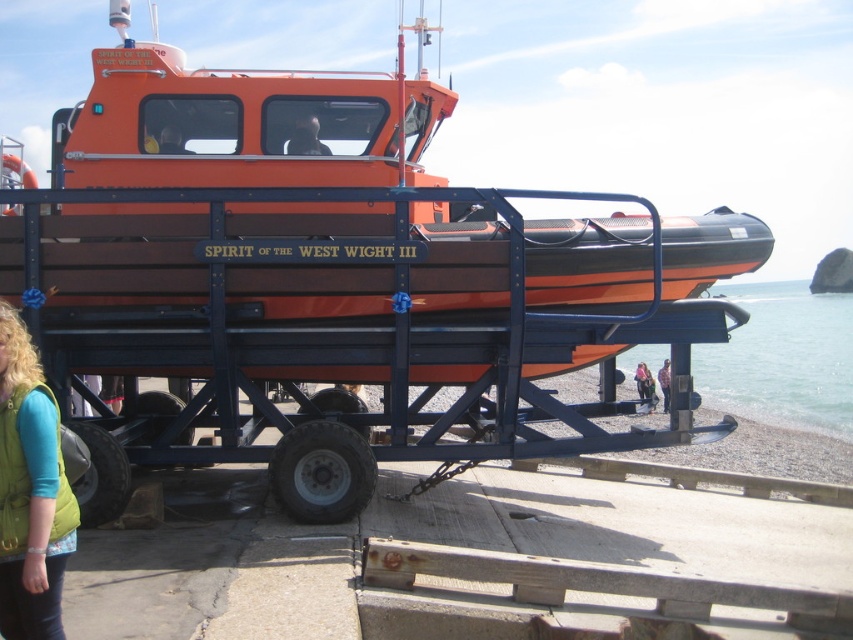
Which is behind, point (15, 483) or point (639, 364)?

Positioned behind is point (639, 364).

Which is more to the left, green fabric vest at lower left or light brown leather jacket at lower center?

green fabric vest at lower left is more to the left.

What do you see at coordinates (30, 492) in the screenshot? The width and height of the screenshot is (853, 640). I see `green fabric vest at lower left` at bounding box center [30, 492].

This screenshot has height=640, width=853. I want to click on green fabric vest at lower left, so click(x=30, y=492).

Does point (316, 128) come farther from viewer compared to point (648, 394)?

No, it is not.

Which of these two, smooth brown hair at center or light brown leather jacket at lower center, stands shorter?

smooth brown hair at center

Is point (294, 147) closer to camera compared to point (637, 388)?

Yes, point (294, 147) is closer to viewer.

You are a GUI agent. You are given a task and a screenshot of the screen. Output one action in this format:
    pyautogui.click(x=<x>, y=<y>)
    Task: Click on the smooth brown hair at center
    
    Given the screenshot: What is the action you would take?
    pyautogui.click(x=306, y=138)

Is green fabric vest at lower left wider than light purple fleece jacket at lower right?

No.

Can you confirm if green fabric vest at lower left is shorter than light purple fleece jacket at lower right?

No.

At what (x,y) coordinates should I click in order to perform the action: click on green fabric vest at lower left. Please return your answer as a coordinate pair (x, y). The height and width of the screenshot is (640, 853). Looking at the image, I should click on (30, 492).